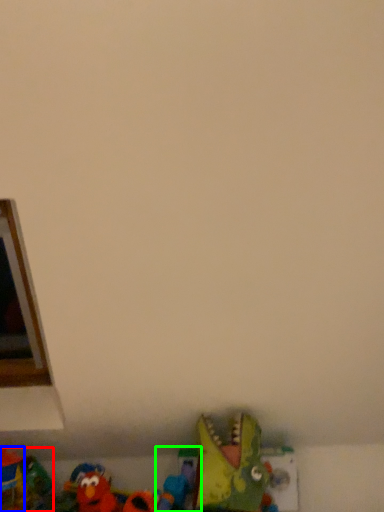
Question: Based on their relative distances, which object is nearer to toy (highlighted by a red box)? Choose from toy (highlighted by a blue box) and toy (highlighted by a green box).

Choices:
 (A) toy
 (B) toy

Answer: (A)